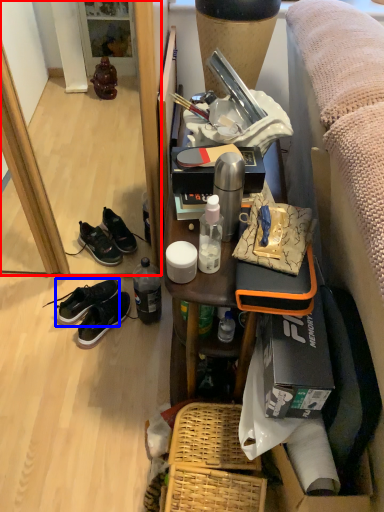
Question: Which point is closer to the camera, mirror (highlighted by a red box) or shoe (highlighted by a blue box)?

Choices:
 (A) mirror
 (B) shoe

Answer: (A)